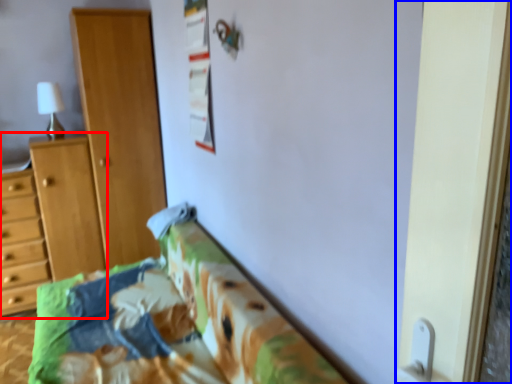
Question: Among these objects, which one is farthest to the camera, vanity (highlighted by a red box) or screen door (highlighted by a blue box)?

Choices:
 (A) vanity
 (B) screen door

Answer: (A)